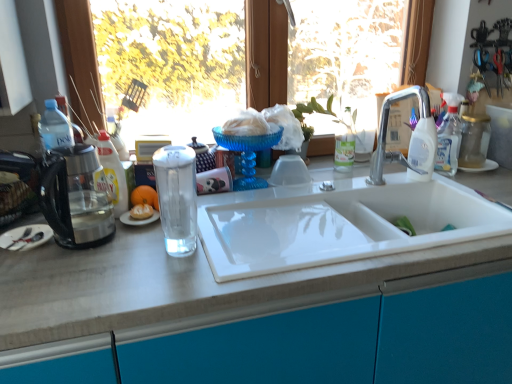
Locate an element on the screen. vacant region to the left of silver metallic faucet at upper right is located at coordinates (333, 186).